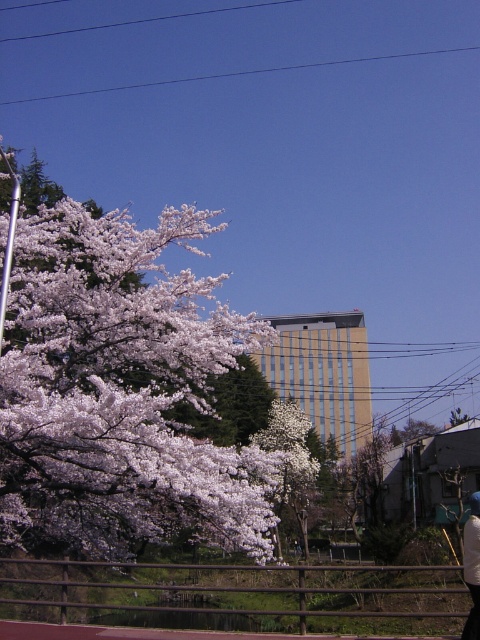
Describe the element at coordinates (289, 458) in the screenshot. I see `white blossoming tree at center` at that location.

In the scene shown: Who is more distant from viewer, [304,536] or [476,522]?

The point [304,536] is more distant.

At what (x,y) coordinates should I click in order to perform the action: click on white blossoming tree at center. Please return your answer as a coordinate pair (x, y). Looking at the image, I should click on (289, 458).

Does white matte flower at upper left appear under white cotton jacket at lower right?

No.

Who is more distant from viewer, (132, 253) or (476, 556)?

Positioned behind is point (132, 253).

I want to click on white matte flower at upper left, so click(116, 387).

The image size is (480, 640). Describe the element at coordinates (116, 387) in the screenshot. I see `white matte flower at upper left` at that location.

Does white matte flower at upper left appear on the left side of white blossoming tree at center?

Indeed, white matte flower at upper left is positioned on the left side of white blossoming tree at center.

Is point (50, 241) positioned in front of point (305, 422)?

Yes, point (50, 241) is in front of point (305, 422).

You are a GUI agent. You are given a task and a screenshot of the screen. Output one action in this format:
    pyautogui.click(x=<x>, y=<y>)
    Task: Click on the white matte flower at upper left
    
    Given the screenshot: What is the action you would take?
    pyautogui.click(x=116, y=387)